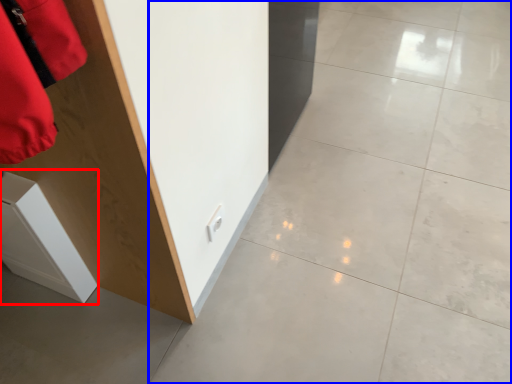
Question: Among these objects, which one is farthest to the camera, cabinetry (highlighted by a red box) or concrete (highlighted by a blue box)?

Choices:
 (A) cabinetry
 (B) concrete

Answer: (A)